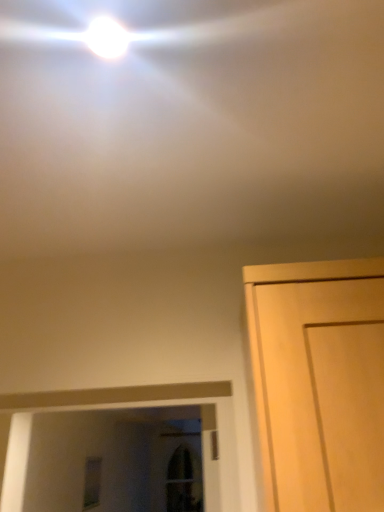
Question: Does light wood door at right have a larger size compared to white glossy droplight at upper center?

Choices:
 (A) yes
 (B) no

Answer: (A)

Question: Can you confirm if light wood door at right is wider than white glossy droplight at upper center?

Choices:
 (A) no
 (B) yes

Answer: (B)

Question: Does light wood door at right have a greater height compared to white glossy droplight at upper center?

Choices:
 (A) yes
 (B) no

Answer: (A)

Question: Is light wood door at right positioned far away from white glossy droplight at upper center?

Choices:
 (A) yes
 (B) no

Answer: (B)

Question: Does light wood door at right appear on the left side of white glossy droplight at upper center?

Choices:
 (A) no
 (B) yes

Answer: (A)

Question: From the image's perspective, would you say light wood door at right is shown under white glossy droplight at upper center?

Choices:
 (A) no
 (B) yes

Answer: (B)

Question: Is clear glass window at lower left far from light wood door at right?

Choices:
 (A) yes
 (B) no

Answer: (A)

Question: Can we say clear glass window at lower left lies outside light wood door at right?

Choices:
 (A) no
 (B) yes

Answer: (B)

Question: Is clear glass window at lower left positioned with its back to light wood door at right?

Choices:
 (A) no
 (B) yes

Answer: (A)

Question: From the image's perspective, is clear glass window at lower left above light wood door at right?

Choices:
 (A) no
 (B) yes

Answer: (A)

Question: Is clear glass window at lower left shorter than light wood door at right?

Choices:
 (A) yes
 (B) no

Answer: (B)

Question: Is clear glass window at lower left further to camera compared to light wood door at right?

Choices:
 (A) no
 (B) yes

Answer: (B)

Question: Is white glossy droplight at upper center bigger than light wood door at right?

Choices:
 (A) no
 (B) yes

Answer: (A)